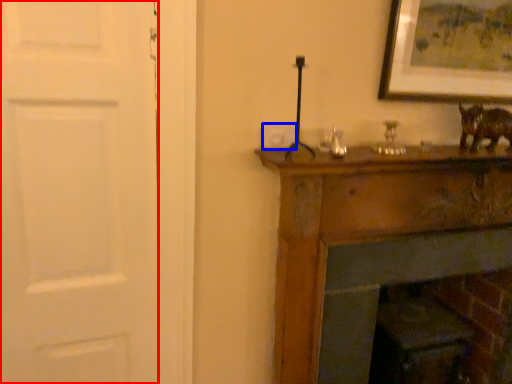
Question: Which point is closer to the camera, door (highlighted by a red box) or light switch (highlighted by a blue box)?

Choices:
 (A) door
 (B) light switch

Answer: (A)